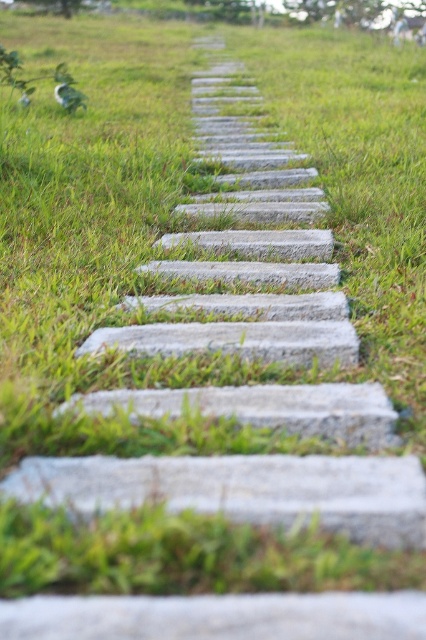
You are standing on the pathway and want to pick up the gray stone at center and the gray concrete stone at center. Which one do you need to bend down more to pick up?

You need to bend down more to pick up the gray concrete stone at center because it is farther away from you than the gray stone at center.

You are standing at the start of the pathway and see the gray stone at center and the gray concrete stone at center. Which one is closer to the ground?

The gray stone at center is closer to the ground because it is positioned below the gray concrete stone at center.

You are standing at the starting point of the pathway and want to place a small flag exactly at the center of the gray stone at center. What are the coordinates where you should place the flag?

The coordinates for the gray stone at center are at point (244, 490), so you should place the flag at those coordinates.